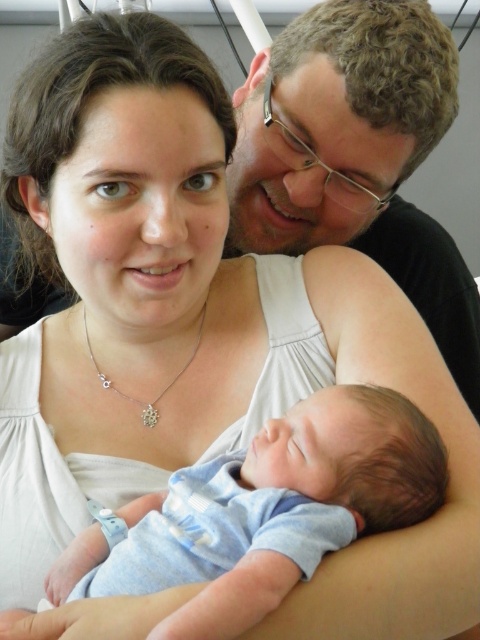
Is blue soft fabric newborn at center wider than silver/glass necklace at center?

Correct, the width of blue soft fabric newborn at center exceeds that of silver/glass necklace at center.

Does blue soft fabric newborn at center have a larger size compared to silver/glass necklace at center?

Indeed, blue soft fabric newborn at center has a larger size compared to silver/glass necklace at center.

Where is `blue soft fabric newborn at center`? Image resolution: width=480 pixels, height=640 pixels. blue soft fabric newborn at center is located at coordinates 268,512.